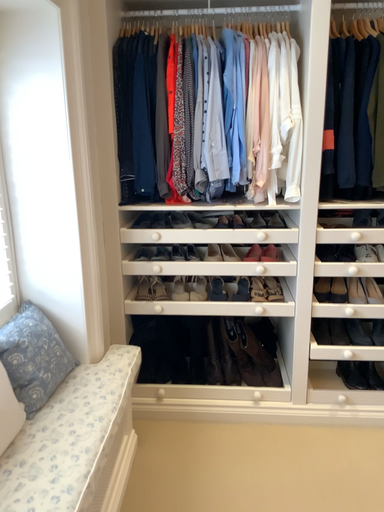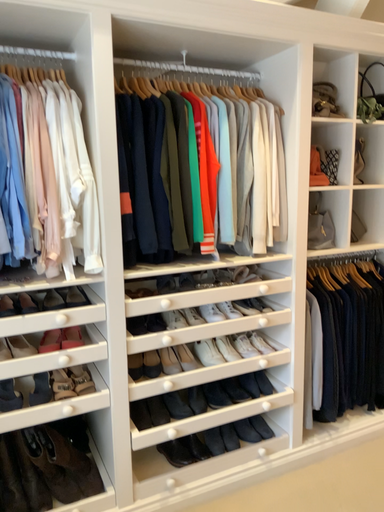
Question: Which way did the camera rotate in the video?

Choices:
 (A) rotated right
 (B) rotated left

Answer: (A)